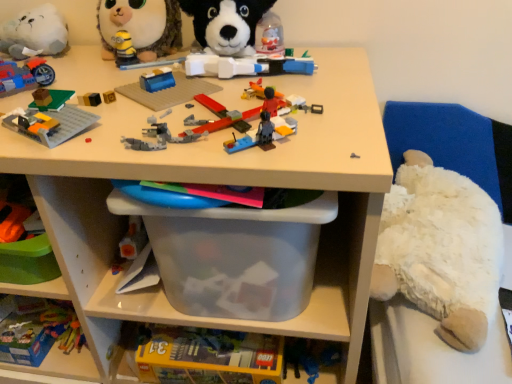
This screenshot has height=384, width=512. I want to click on empty space that is to the right of translucent plastic baseplate at upper left, the fifth toy from the right, so click(156, 116).